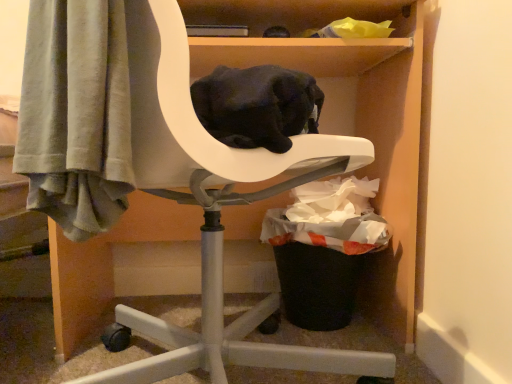
Question: Is point (331, 289) closer or farther from the camera than point (368, 79)?

Choices:
 (A) farther
 (B) closer

Answer: (B)

Question: From the image's perspective, is black plastic trash can at lower right positioned above or below white plastic chair at center?

Choices:
 (A) above
 (B) below

Answer: (B)

Question: Would you say black plastic trash can at lower right is to the left or to the right of white plastic chair at center in the picture?

Choices:
 (A) left
 (B) right

Answer: (B)

Question: In the image, is white plastic chair at center on the left side or the right side of black plastic trash can at lower right?

Choices:
 (A) right
 (B) left

Answer: (B)

Question: Would you say white plastic chair at center is inside or outside black plastic trash can at lower right?

Choices:
 (A) outside
 (B) inside

Answer: (A)

Question: Is white plastic chair at center wider or thinner than black plastic trash can at lower right?

Choices:
 (A) thin
 (B) wide

Answer: (B)

Question: Does point (209, 147) appear closer or farther from the camera than point (292, 233)?

Choices:
 (A) closer
 (B) farther

Answer: (A)